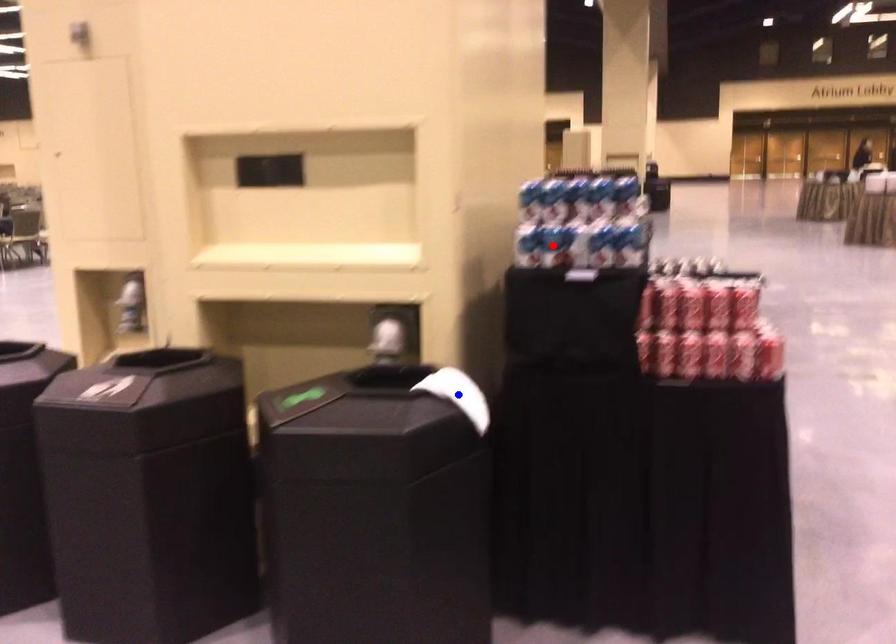
Question: In the image, two points are highlighted. Which point is nearer to the camera? Reply with the corresponding letter.

Choices:
 (A) blue point
 (B) red point

Answer: (A)